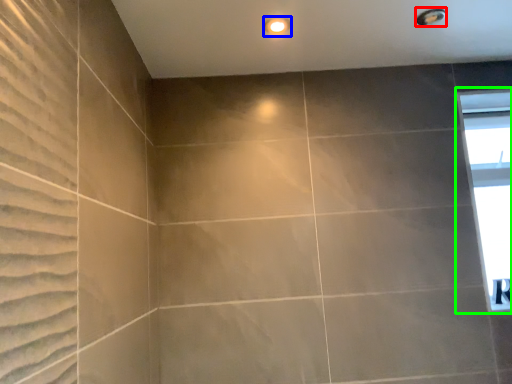
Question: Which is nearer to the shower (highlighted by a red box)? lighting (highlighted by a blue box) or window (highlighted by a green box).

Choices:
 (A) lighting
 (B) window

Answer: (A)